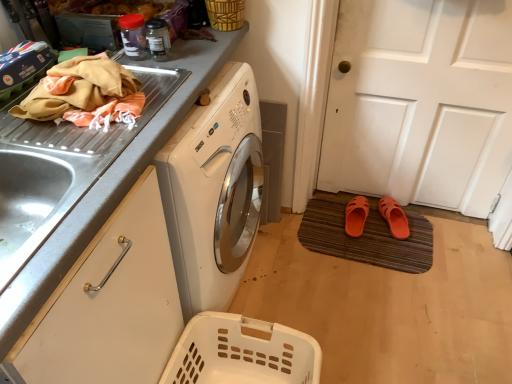
The image size is (512, 384). I want to click on vacant area that is in front of orange rubber sandals at lower right, which appears as the 2th footwear when viewed from the left, so click(399, 255).